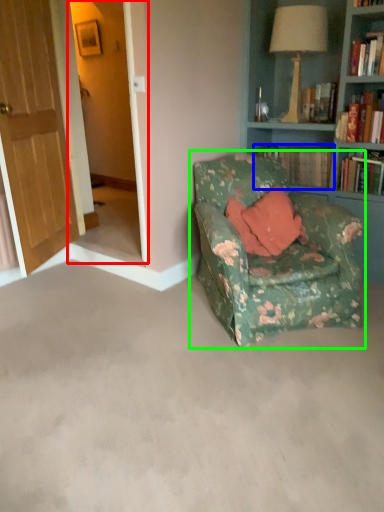
Question: Which is nearer to the screen door (highlighted by a red box)? book (highlighted by a blue box) or chair (highlighted by a green box).

Choices:
 (A) book
 (B) chair

Answer: (A)